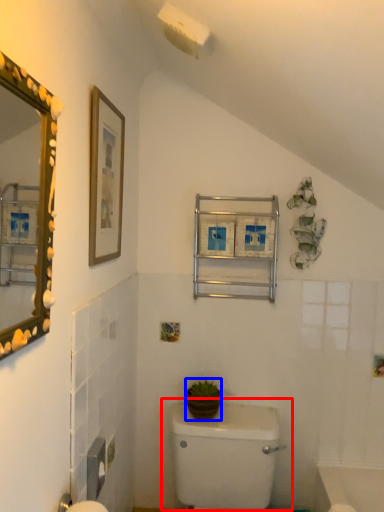
Question: Which point is further to the camera, toilet (highlighted by a red box) or plant (highlighted by a blue box)?

Choices:
 (A) toilet
 (B) plant

Answer: (B)